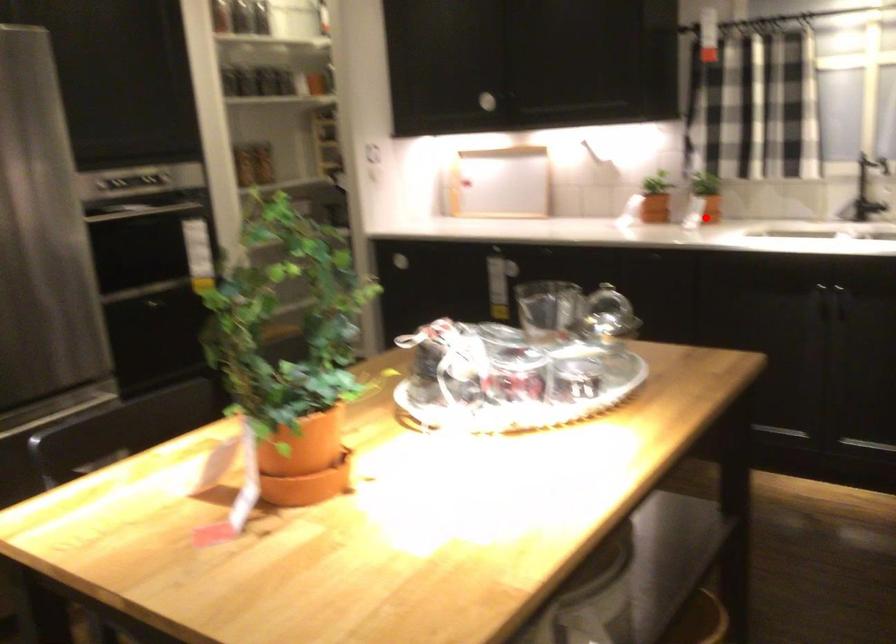
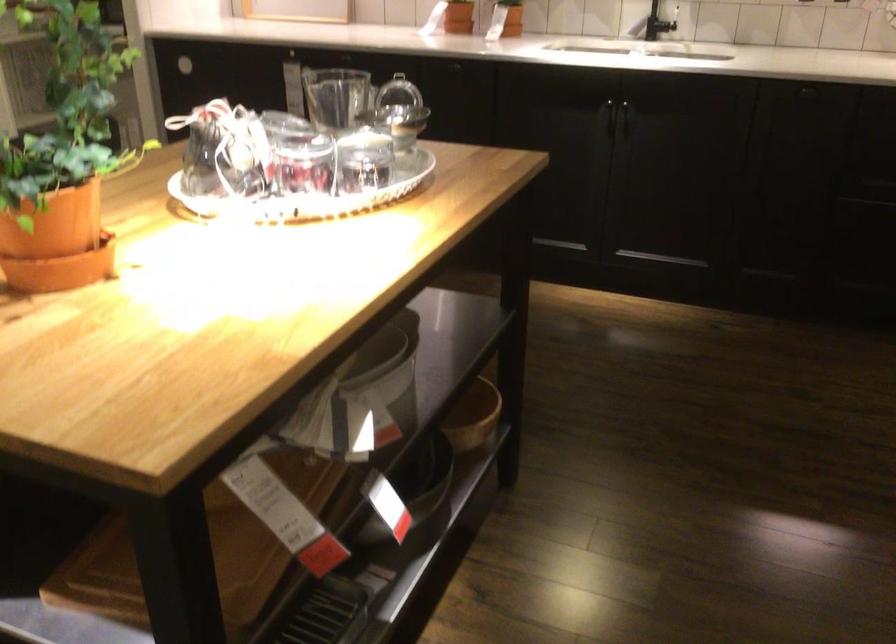
Locate, in the second image, the point that corresponds to the highlighted location in the first image.

(504, 31)